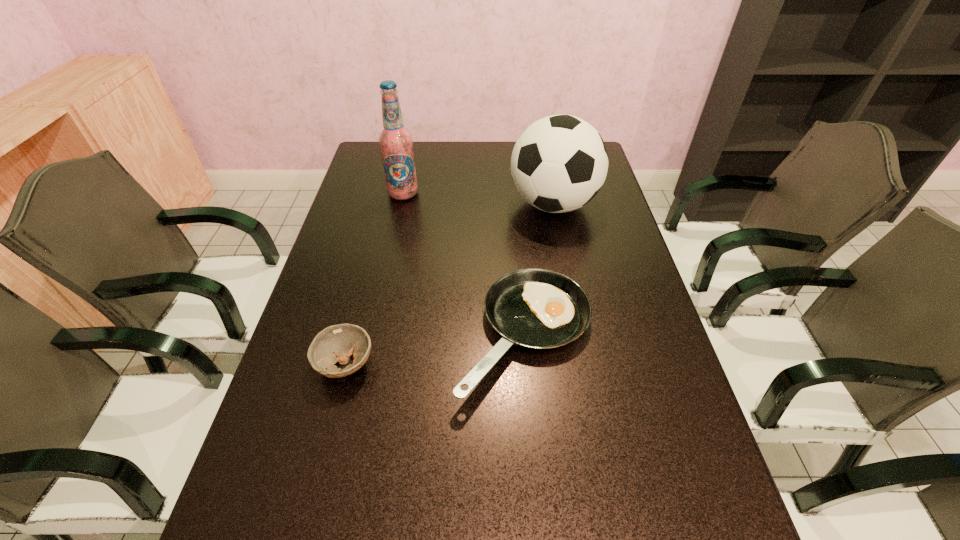
This screenshot has width=960, height=540. What are the coordinates of `the tallest object` in the screenshot? It's located at point(396,142).

The image size is (960, 540). I want to click on the second tallest object, so click(x=559, y=163).

Locate an element on the screen. Image resolution: width=960 pixels, height=540 pixels. bowl is located at coordinates (335, 343).

You are a GUI agent. You are given a task and a screenshot of the screen. Output one action in this format:
    pyautogui.click(x=<x>, y=<y>)
    Task: Click on the frying pan
    
    Given the screenshot: What is the action you would take?
    pyautogui.click(x=536, y=308)

Find the location of `vacant space situated on the back of the tallest object`. vacant space situated on the back of the tallest object is located at coordinates (408, 172).

The width and height of the screenshot is (960, 540). What are the coordinates of `vacant space situated on the back of the soccer ball` in the screenshot? It's located at (546, 171).

The width and height of the screenshot is (960, 540). I want to click on vacant area situated on the back of the bowl, so click(368, 275).

The image size is (960, 540). I want to click on free space located 0.200m on the back of the frying pan, so click(516, 232).

You are a GUI agent. You are given a task and a screenshot of the screen. Output one action in this format:
    pyautogui.click(x=<x>, y=<y>)
    Task: Click on the alcohol that is positioned at the left edge
    The height and width of the screenshot is (540, 960).
    Given the screenshot: What is the action you would take?
    pyautogui.click(x=396, y=142)

The height and width of the screenshot is (540, 960). I want to click on bowl present at the left edge, so click(335, 343).